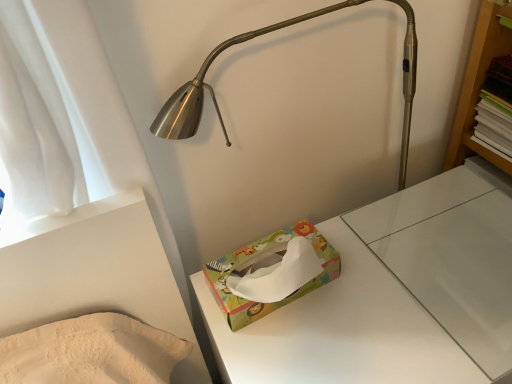
This screenshot has width=512, height=384. Find the location of `space that is in front of multicolored paper tissue box at center`. space that is in front of multicolored paper tissue box at center is located at coordinates (306, 350).